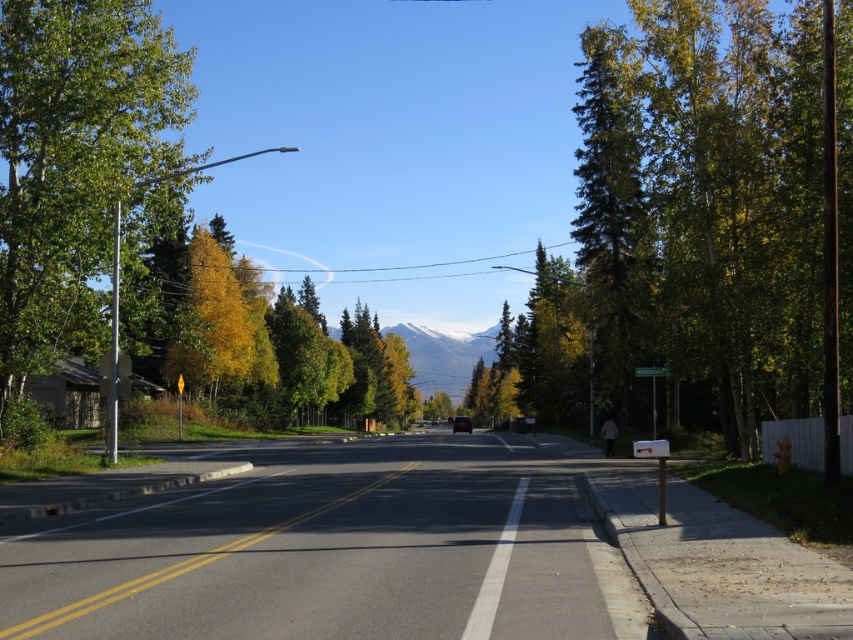
Does yellow leafy tree at left have a larger size compared to green plastic street sign at center?

Indeed, yellow leafy tree at left has a larger size compared to green plastic street sign at center.

Image resolution: width=853 pixels, height=640 pixels. What do you see at coordinates (218, 316) in the screenshot?
I see `yellow leafy tree at left` at bounding box center [218, 316].

Does point (241, 307) lie in front of point (660, 369)?

No, (241, 307) is behind (660, 369).

At what (x,y) coordinates should I click in order to perform the action: click on yellow leafy tree at left. Please return your answer as a coordinate pair (x, y). This screenshot has height=640, width=853. Looking at the image, I should click on (218, 316).

Does green leafy tree at right appear over snowy mountain at center?

Indeed, green leafy tree at right is positioned over snowy mountain at center.

Does green leafy tree at right have a smaller size compared to snowy mountain at center?

Incorrect, green leafy tree at right is not smaller in size than snowy mountain at center.

Is point (611, 292) less distant than point (340, 332)?

That is True.

The height and width of the screenshot is (640, 853). I want to click on green leafy tree at right, so click(720, 205).

Who is positioned more to the left, green leafy tree at right or green leafy tree at left?

From the viewer's perspective, green leafy tree at left appears more on the left side.

Between green leafy tree at right and green leafy tree at left, which one is positioned higher?

green leafy tree at right is higher up.

Does point (683, 161) lie behind point (119, 99)?

Yes, it is behind point (119, 99).

Image resolution: width=853 pixels, height=640 pixels. Find the location of `green leafy tree at right`. green leafy tree at right is located at coordinates (720, 205).